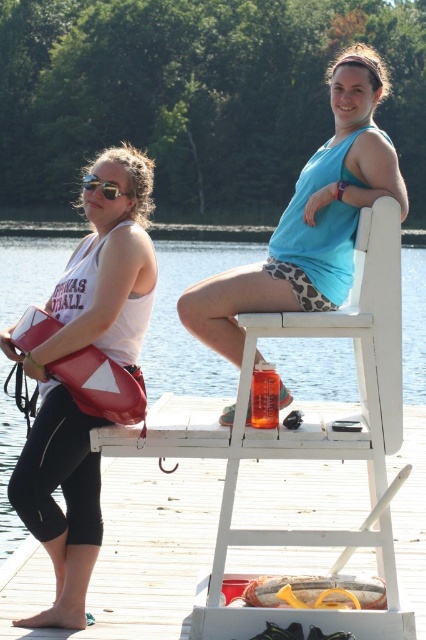
You are standing on the white wood dock at center and want to reach the blue fabric tank top at center. Which direction should you move to get there?

Since the white wood dock at center is to the left of the blue fabric tank top at center, you should move to the right to reach it.

You are a photographer positioned in front of the scene. You notice the matte white tank top at left and the matte black sunglasses at left. Which object is nearer to you?

The matte white tank top at left is closer to the viewer than the matte black sunglasses at left.